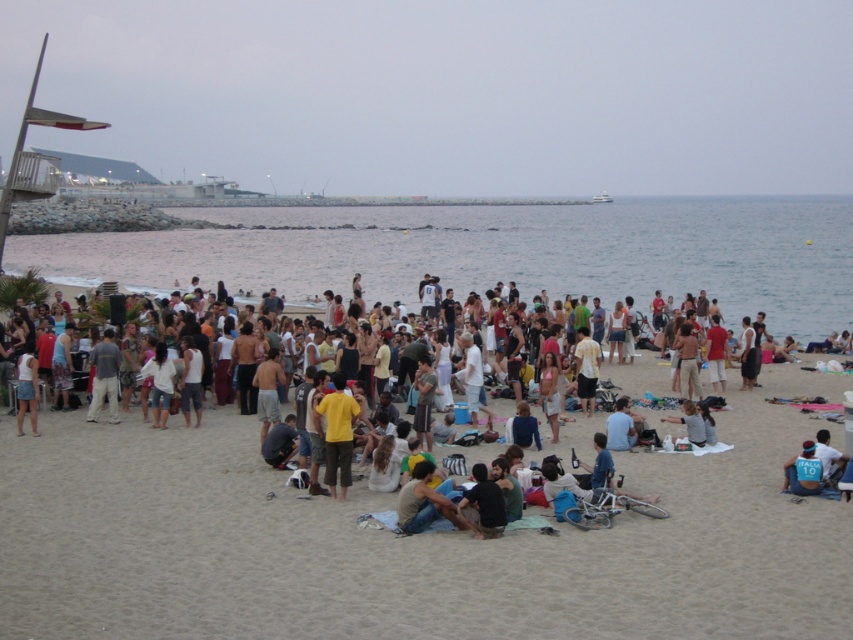
What do you see at coordinates (401, 545) in the screenshot?
I see `light beige sand at center` at bounding box center [401, 545].

Is light beige sand at center positioned in front of yellow matte shirt at center?

Yes, it is.

In order to click on light beige sand at center in this screenshot , I will do `click(401, 545)`.

Can you confirm if light beige sand at center is positioned to the right of blue jersey at lower right?

Incorrect, light beige sand at center is not on the right side of blue jersey at lower right.

This screenshot has height=640, width=853. What are the coordinates of `light beige sand at center` in the screenshot? It's located at (401, 545).

Locate an element on the screen. This screenshot has width=853, height=640. light beige sand at center is located at coordinates (401, 545).

Is point (457, 529) more distant than point (585, 340)?

No, it is in front of (585, 340).

Consider the image. Can you confirm if jeans at center is positioned to the left of yellow cotton shirt at center?

Indeed, jeans at center is positioned on the left side of yellow cotton shirt at center.

Find the location of `jeans at center`. jeans at center is located at coordinates (426, 500).